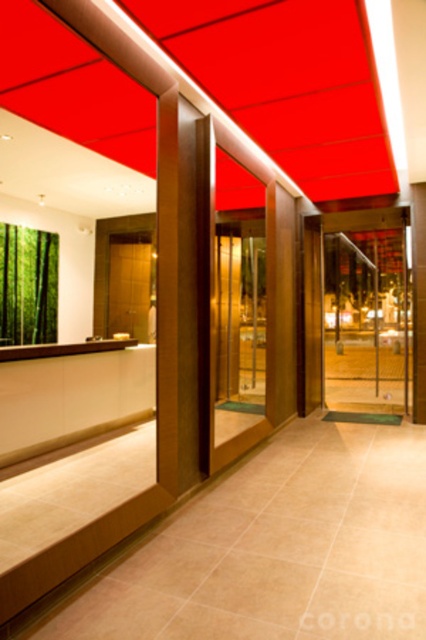
Who is higher up, wooden pillar at center or transparent glass door at center?

wooden pillar at center is higher up.

Does wooden pillar at center have a lesser width compared to transparent glass door at center?

Yes.

This screenshot has width=426, height=640. Identify the location of wooden pillar at center. (183, 292).

I want to click on wooden pillar at center, so click(x=183, y=292).

Does wooden pillar at center appear over green bamboo curtain at left?

No.

Does wooden pillar at center have a lesser height compared to green bamboo curtain at left?

In fact, wooden pillar at center may be taller than green bamboo curtain at left.

Describe the element at coordinates (183, 292) in the screenshot. Image resolution: width=426 pixels, height=640 pixels. I see `wooden pillar at center` at that location.

This screenshot has width=426, height=640. Identify the location of wooden pillar at center. (183, 292).

Does matte red ceiling at upper center appear under wooden pillar at center?

No.

Does matte red ceiling at upper center appear over wooden pillar at center?

Indeed, matte red ceiling at upper center is positioned over wooden pillar at center.

You are a GUI agent. You are given a task and a screenshot of the screen. Output one action in this format:
    pyautogui.click(x=<x>, y=<y>)
    Task: Click on the matte red ceiling at upper center
    This screenshot has width=426, height=640.
    Given the screenshot: What is the action you would take?
    pyautogui.click(x=288, y=83)